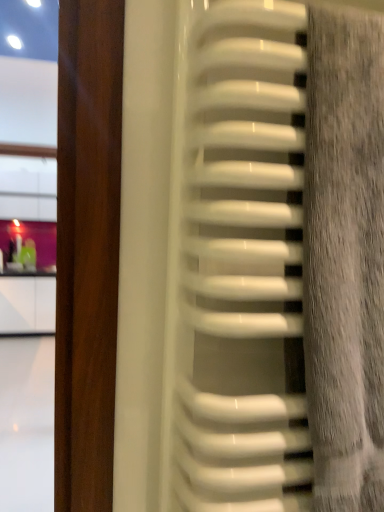
This screenshot has height=512, width=384. Describe the element at coordinates (242, 264) in the screenshot. I see `white glossy radiator at center` at that location.

In order to face white glossy radiator at center, should I rotate leftwards or rightwards?

A 16.025 degree turn to the right will do.

The width and height of the screenshot is (384, 512). Find the location of `white glossy radiator at center`. white glossy radiator at center is located at coordinates (242, 264).

Locate an element on the screen. The image size is (384, 512). white glossy radiator at center is located at coordinates (242, 264).